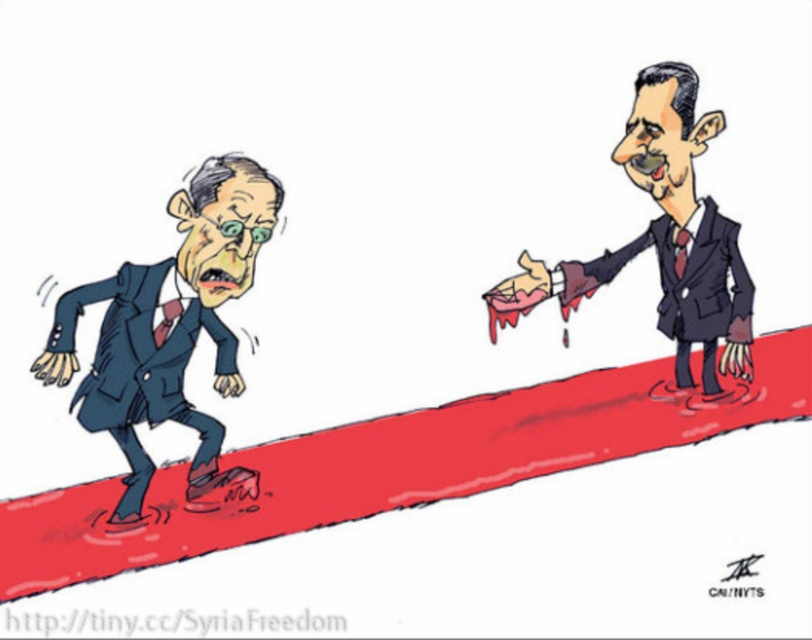
From the picture: Who is more distant from viewer, (128, 292) or (661, 314)?

Point (661, 314)

Who is positioned more to the left, matte blue suit at left or dark blue suit at right?

Positioned to the left is matte blue suit at left.

Is point (171, 353) positioned after point (590, 289)?

No, it is not.

Identify the location of matte blue suit at left. This screenshot has height=640, width=812. (169, 328).

Does matte blue suit at left appear under smooth suit at upper right?

Indeed, matte blue suit at left is positioned under smooth suit at upper right.

Between matte blue suit at left and smooth suit at upper right, which one has more height?

Standing taller between the two is matte blue suit at left.

Between point (141, 388) and point (718, 244), which one is positioned behind?

The point (718, 244) is more distant.

At what (x,y) coordinates should I click in order to perform the action: click on matte blue suit at left. Please return your answer as a coordinate pair (x, y). This screenshot has height=640, width=812. Looking at the image, I should click on (169, 328).

Between smooth suit at upper right and dark blue suit at right, which one has more height?

With more height is smooth suit at upper right.

Between smooth suit at upper right and dark blue suit at right, which one is positioned higher?

smooth suit at upper right is higher up.

The image size is (812, 640). I want to click on smooth suit at upper right, so click(x=677, y=232).